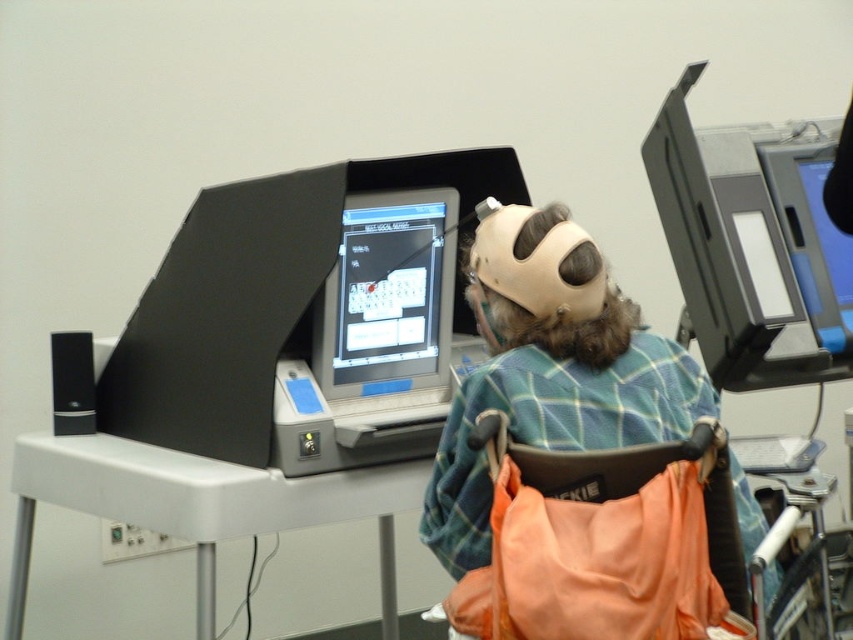
You are a voting booth inspector checking the setup. You notice an orange fabric chair at lower right and a plaid fabric shirt at center. Which object is located below the other?

The orange fabric chair at lower right is positioned under plaid fabric shirt at center, so the orange fabric chair is below the plaid fabric shirt at center.

You are setting up a voting station and need to place an orange fabric chair at lower right. According to the image, where should you position it?

The orange fabric chair at lower right should be positioned at point (x=613, y=538) as specified in the description.